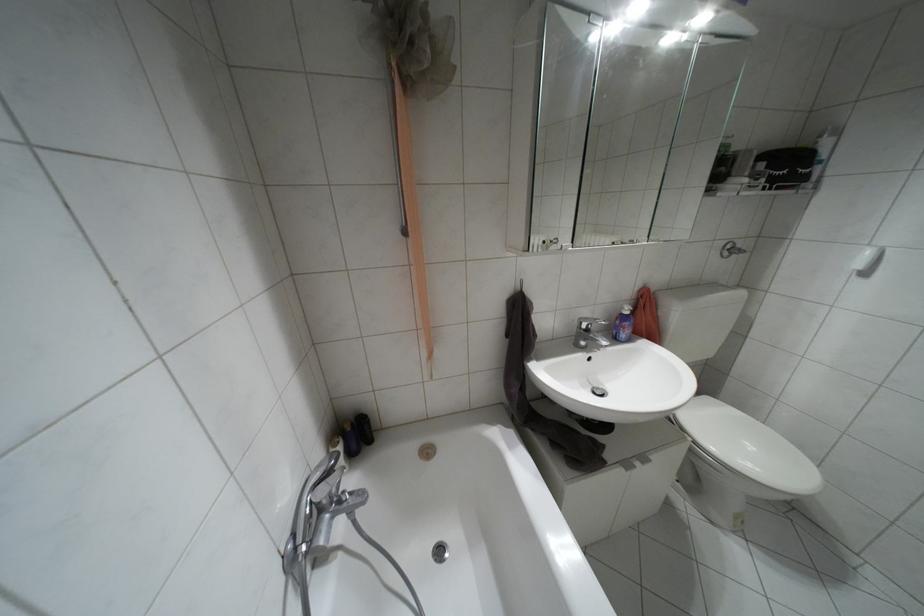
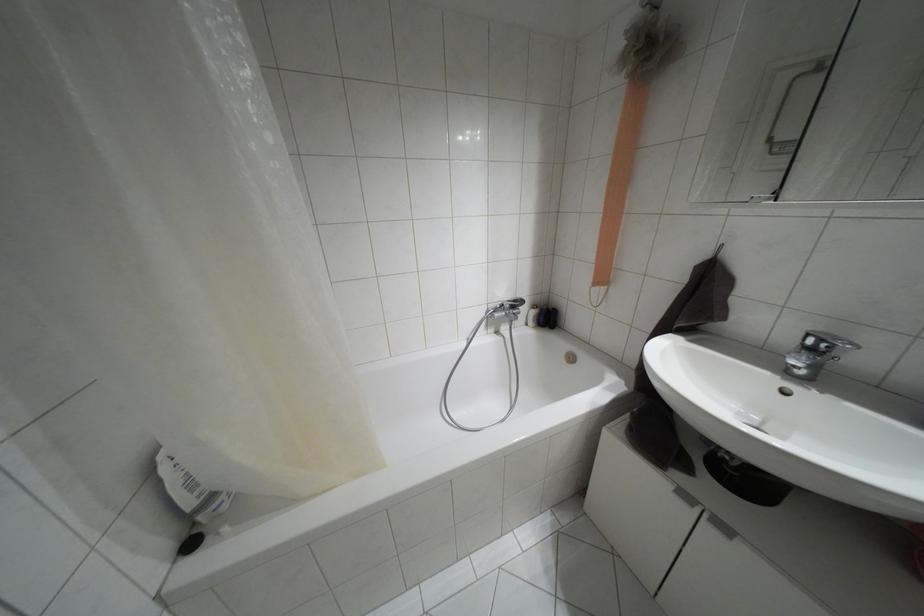
Where in the second image is the point corresponding to the point at 642,458 from the first image?

(723, 528)